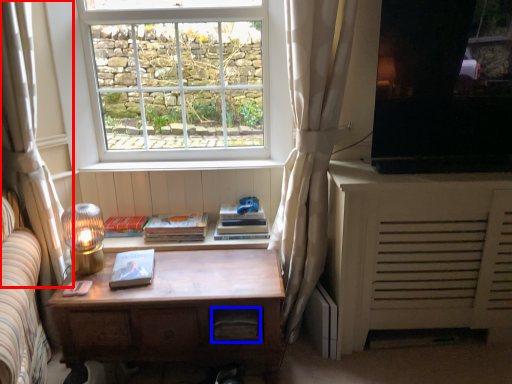
Question: Which object appears farthest to the camera in this image, curtain (highlighted by a red box) or drawer (highlighted by a blue box)?

Choices:
 (A) curtain
 (B) drawer

Answer: (B)